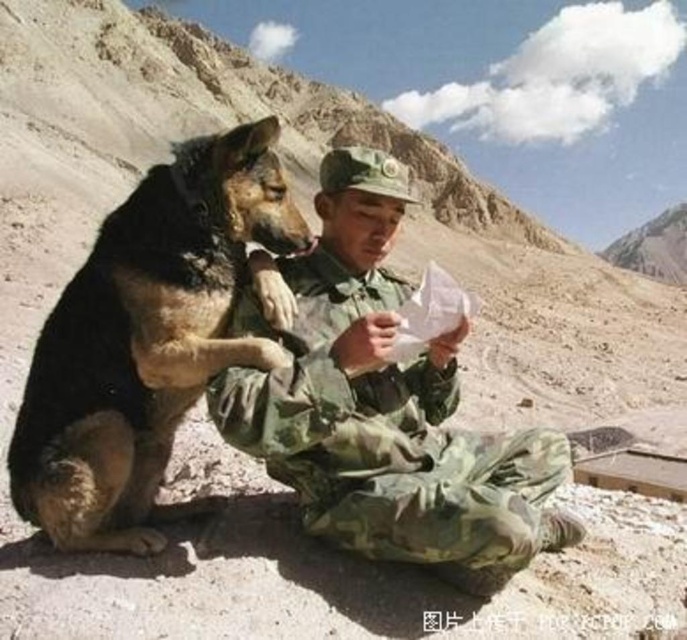
You are a photographer trying to capture a photo of the camouflage uniform at center and the black fur dog at left. You want to ensure both subjects are in focus. Since you can only adjust the focus distance, which subject should you prioritize focusing on to maximize the chances of both being clear?

The camouflage uniform at center has a lesser width compared to black fur dog at left, so focusing on the black fur dog at left would cover a larger area, increasing the likelihood of both being in focus.